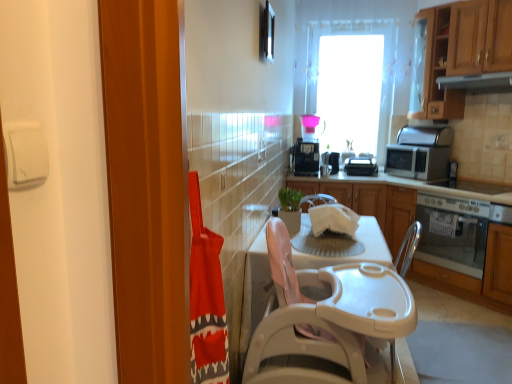
Question: Is white plastic toaster at center, which is the second appliance in right-to-left order, in contact with white plastic sink at center?

Choices:
 (A) no
 (B) yes

Answer: (A)

Question: Considering the relative sizes of white plastic toaster at center, which is the second appliance in right-to-left order, and white plastic sink at center in the image provided, is white plastic toaster at center, which is the second appliance in right-to-left order, bigger than white plastic sink at center?

Choices:
 (A) no
 (B) yes

Answer: (A)

Question: Is white plastic toaster at center, which is the second appliance in right-to-left order, not near white plastic sink at center?

Choices:
 (A) yes
 (B) no

Answer: (A)

Question: Is white plastic toaster at center, the third appliance from the left, outside white plastic sink at center?

Choices:
 (A) no
 (B) yes

Answer: (B)

Question: From the image's perspective, would you say white plastic toaster at center, which is the second appliance in right-to-left order, is positioned over white plastic sink at center?

Choices:
 (A) no
 (B) yes

Answer: (B)

Question: From a real-world perspective, is silver metallic microwave at right, which appears as the 4th appliance when viewed from the left, physically located above or below white plastic table at center, which ranks as the 2th table in back-to-front order?

Choices:
 (A) above
 (B) below

Answer: (A)

Question: Is silver metallic microwave at right, which appears as the 4th appliance when viewed from the left, to the left or to the right of white plastic table at center, which ranks as the 2th table in back-to-front order, in the image?

Choices:
 (A) right
 (B) left

Answer: (A)

Question: Is point (399, 153) positioned closer to the camera than point (355, 379)?

Choices:
 (A) farther
 (B) closer

Answer: (A)

Question: Based on their sizes in the image, would you say silver metallic microwave at right, which appears as the 4th appliance when viewed from the left, is bigger or smaller than white plastic table at center, which is the first table from front to back?

Choices:
 (A) big
 (B) small

Answer: (B)

Question: From the image's perspective, is white plastic table at center, which ranks as the 2th table in back-to-front order, positioned above or below white plastic toaster at center, the third appliance from the left?

Choices:
 (A) below
 (B) above

Answer: (A)

Question: Considering the positions of white plastic table at center, which is the first table from front to back, and white plastic toaster at center, which is the second appliance in right-to-left order, in the image, is white plastic table at center, which is the first table from front to back, bigger or smaller than white plastic toaster at center, which is the second appliance in right-to-left order,?

Choices:
 (A) big
 (B) small

Answer: (A)

Question: From a real-world perspective, is white plastic table at center, which ranks as the 2th table in back-to-front order, physically located above or below white plastic toaster at center, which is the second appliance in right-to-left order?

Choices:
 (A) below
 (B) above

Answer: (A)

Question: From their relative heights in the image, would you say white plastic table at center, which ranks as the 2th table in back-to-front order, is taller or shorter than white plastic toaster at center, the third appliance from the left?

Choices:
 (A) short
 (B) tall

Answer: (B)

Question: Considering the positions of transparent glass window at upper center and white plastic table at center, positioned as the first table in back-to-front order, in the image, is transparent glass window at upper center wider or thinner than white plastic table at center, positioned as the first table in back-to-front order,?

Choices:
 (A) thin
 (B) wide

Answer: (A)

Question: From the image's perspective, is transparent glass window at upper center above or below white plastic table at center, the 2th table viewed from the front?

Choices:
 (A) below
 (B) above

Answer: (B)